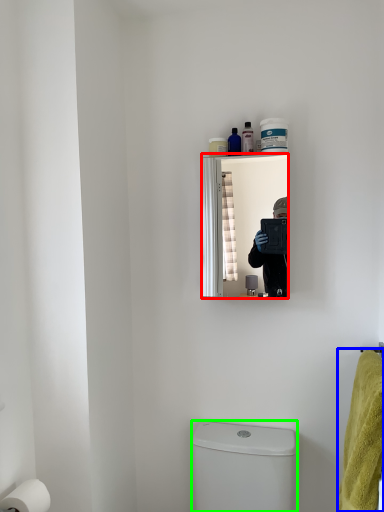
Question: Considering the real-world distances, which object is farthest from mirror (highlighted by a red box)? bath towel (highlighted by a blue box) or toilet bowl (highlighted by a green box)?

Choices:
 (A) bath towel
 (B) toilet bowl

Answer: (A)